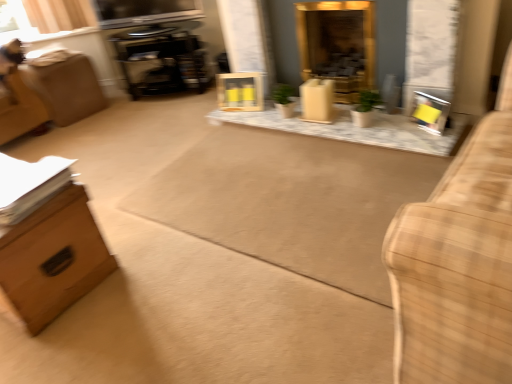
The image size is (512, 384). Describe the element at coordinates (17, 98) in the screenshot. I see `wooden swivel chair at left` at that location.

What do you see at coordinates (338, 45) in the screenshot? The height and width of the screenshot is (384, 512). I see `gold metallic fireplace at center` at bounding box center [338, 45].

What is the approximate width of brown cardboard box at left?

brown cardboard box at left is 18.21 inches in width.

This screenshot has width=512, height=384. I want to click on wooden table at center, so click(x=354, y=129).

What are the coordinates of `yellow cardboard picture frame at right, marked as the 1th picture frame in a right-to-left arrangement` in the screenshot? It's located at (431, 111).

In the scene shown: How much distance is there between wooden swivel chair at left and black glossy entertainment center at upper left?

wooden swivel chair at left is 1.40 meters away from black glossy entertainment center at upper left.

From the picture: Can you confirm if wooden swivel chair at left is taller than black glossy entertainment center at upper left?

Yes, wooden swivel chair at left is taller than black glossy entertainment center at upper left.

Considering the sizes of objects wooden swivel chair at left and black glossy entertainment center at upper left in the image provided, who is wider, wooden swivel chair at left or black glossy entertainment center at upper left?

Wider between the two is wooden swivel chair at left.

From a real-world perspective, which is physically below, wooden swivel chair at left or black glossy entertainment center at upper left?

black glossy entertainment center at upper left.

From the image's perspective, does black glossy entertainment center at upper left appear higher than wooden swivel chair at left?

Yes, from the image's perspective, black glossy entertainment center at upper left is above wooden swivel chair at left.

What's the angular difference between black glossy entertainment center at upper left and wooden swivel chair at left's facing directions?

They differ by 65.8 degrees in their facing directions.

Which object is positioned more to the left, black glossy entertainment center at upper left or wooden swivel chair at left?

Positioned to the left is wooden swivel chair at left.

From a real-world perspective, does black glossy entertainment center at upper left sit lower than wooden swivel chair at left?

Yes, from a real-world perspective, black glossy entertainment center at upper left is below wooden swivel chair at left.

Considering the sizes of wooden swivel chair at left and gold metallic fireplace at center in the image, is wooden swivel chair at left wider or thinner than gold metallic fireplace at center?

wooden swivel chair at left is wider than gold metallic fireplace at center.

Consider the image. Would you say gold metallic fireplace at center is part of wooden swivel chair at left's contents?

No, gold metallic fireplace at center is located outside of wooden swivel chair at left.

Can you confirm if wooden swivel chair at left is taller than gold metallic fireplace at center?

Indeed, wooden swivel chair at left has a greater height compared to gold metallic fireplace at center.

Does wooden swivel chair at left have a larger size compared to gold metallic fireplace at center?

Correct, wooden swivel chair at left is larger in size than gold metallic fireplace at center.

Is wooden frame at center, arranged as the second picture frame when viewed from the front, taller or shorter than plaid fabric couch at right?

In the image, wooden frame at center, arranged as the second picture frame when viewed from the front, appears to be shorter than plaid fabric couch at right.

In the image, is wooden frame at center, the first picture frame positioned from the left, positioned in front of or behind plaid fabric couch at right?

wooden frame at center, the first picture frame positioned from the left, is behind plaid fabric couch at right.

Which point is more distant from viewer, (x=245, y=109) or (x=430, y=307)?

The point (x=245, y=109) is behind.

Is black glossy entertainment center at upper left at the back of brown cardboard box at left?

brown cardboard box at left is not turned away from black glossy entertainment center at upper left.

How different are the orientations of brown cardboard box at left and black glossy entertainment center at upper left in degrees?

157 degrees separate the facing orientations of brown cardboard box at left and black glossy entertainment center at upper left.

Can we say brown cardboard box at left lies outside black glossy entertainment center at upper left?

Absolutely, brown cardboard box at left is external to black glossy entertainment center at upper left.

Is point (54, 282) farther from camera compared to point (196, 26)?

No.

Between black glossy entertainment center at upper left and wooden frame at center, placed as the 2th picture frame when sorted from bottom to top, which one appears on the left side from the viewer's perspective?

black glossy entertainment center at upper left.

Is black glossy entertainment center at upper left not inside wooden frame at center, positioned as the first picture frame in back-to-front order?

Yes, black glossy entertainment center at upper left is not within wooden frame at center, positioned as the first picture frame in back-to-front order.

Considering the sizes of black glossy entertainment center at upper left and wooden frame at center, placed as the 2th picture frame when sorted from bottom to top, in the image, is black glossy entertainment center at upper left wider or thinner than wooden frame at center, placed as the 2th picture frame when sorted from bottom to top,?

black glossy entertainment center at upper left is wider than wooden frame at center, placed as the 2th picture frame when sorted from bottom to top.

Image resolution: width=512 pixels, height=384 pixels. I want to click on fireplace located above the black glossy entertainment center at upper left (from a real-world perspective), so click(338, 45).

Is black glossy entertainment center at upper left positioned beyond the bounds of gold metallic fireplace at center?

Absolutely, black glossy entertainment center at upper left is external to gold metallic fireplace at center.

Is the position of black glossy entertainment center at upper left less distant than that of gold metallic fireplace at center?

No, black glossy entertainment center at upper left is further to the viewer.

From a real-world perspective, between black glossy entertainment center at upper left and gold metallic fireplace at center, who is vertically higher?

From a 3D spatial view, gold metallic fireplace at center is above.

The image size is (512, 384). Find the location of `swivel chair that appears above the black glossy entertainment center at upper left (from a real-world perspective)`. swivel chair that appears above the black glossy entertainment center at upper left (from a real-world perspective) is located at coordinates (17, 98).

At what (x,y) coordinates should I click in order to perform the action: click on entertainment center above the wooden swivel chair at left (from the image's perspective). Please return your answer as a coordinate pair (x, y). Looking at the image, I should click on (207, 31).

Estimate the real-world distances between objects in this image. Which object is further from black glossy entertainment center at upper left, wooden frame at center, the first picture frame positioned from the left, or wooden swivel chair at left?

The object further to black glossy entertainment center at upper left is wooden swivel chair at left.

Based on their spatial positions, is wooden table at center or black glossy entertainment center at upper left closer to yellow cardboard picture frame at right, which ranks as the first picture frame in bottom-to-top order?

Based on the image, wooden table at center appears to be nearer to yellow cardboard picture frame at right, which ranks as the first picture frame in bottom-to-top order.

Which object lies nearer to the anchor point yellow cardboard picture frame at right, which is the 1th picture frame in front-to-back order, wooden table at center or matte wood box at center?

wooden table at center is closer to yellow cardboard picture frame at right, which is the 1th picture frame in front-to-back order.

Based on their spatial positions, is brown cardboard box at left or yellow cardboard picture frame at right, which is the 2th picture frame from top to bottom, further from black glossy entertainment center at upper left?

The object further to black glossy entertainment center at upper left is brown cardboard box at left.

From the image, which object appears to be farther from wooden swivel chair at left, black glossy entertainment center at upper left or matte wood box at center?

matte wood box at center is positioned further to the anchor wooden swivel chair at left.

Based on their spatial positions, is wooden frame at center, arranged as the second picture frame when viewed from the front, or yellow cardboard picture frame at right, which ranks as the first picture frame in bottom-to-top order, closer to wooden swivel chair at left?

The object closer to wooden swivel chair at left is wooden frame at center, arranged as the second picture frame when viewed from the front.

Looking at the image, which one is located closer to wooden swivel chair at left, matte wood box at center or black glossy entertainment center at upper left?

black glossy entertainment center at upper left lies closer to wooden swivel chair at left than the other object.

Considering their positions, is yellow cardboard picture frame at right, which ranks as the first picture frame in bottom-to-top order, positioned further to gold metallic fireplace at center than wooden frame at center, placed as the second picture frame when sorted from right to left?

yellow cardboard picture frame at right, which ranks as the first picture frame in bottom-to-top order, lies further to gold metallic fireplace at center than the other object.

I want to click on fireplace located between wooden table at center and yellow cardboard picture frame at right, which is the 2th picture frame from top to bottom, in the left-right direction, so [338, 45].

This screenshot has width=512, height=384. What are the coordinates of `picture frame between wooden swivel chair at left and matte wood box at center from left to right` in the screenshot? It's located at (240, 91).

Where is `table between plaid fabric couch at right and black glossy entertainment center at upper left in the front-back direction`? The width and height of the screenshot is (512, 384). table between plaid fabric couch at right and black glossy entertainment center at upper left in the front-back direction is located at coordinates (x=354, y=129).

Image resolution: width=512 pixels, height=384 pixels. I want to click on table between brown cardboard box at left and black glossy entertainment center at upper left from front to back, so click(x=354, y=129).